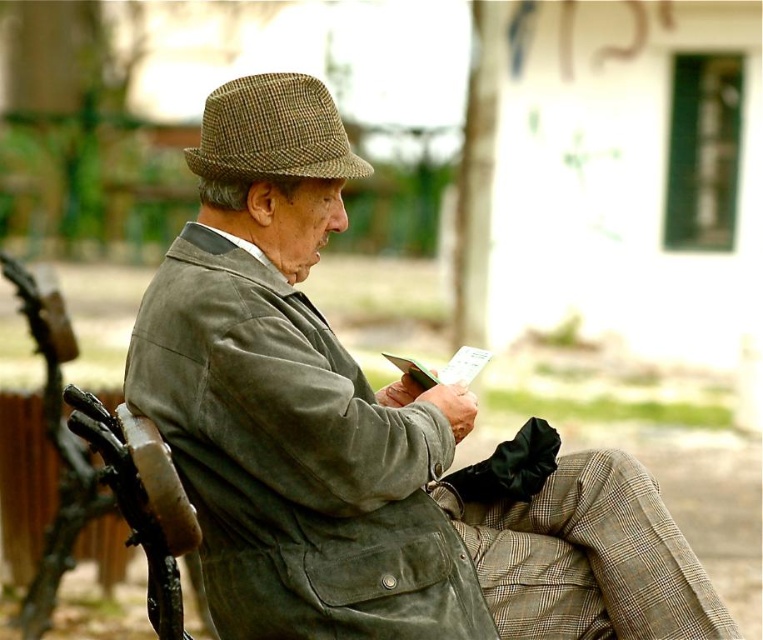
Based on the photo, you are a tailor who needs to determine which item requires more fabric to alter between the green corduroy trench coat at center and the brown checkered fedora at upper center. Based on their sizes, which one would need more fabric?

The green corduroy trench coat at center requires more fabric than the brown checkered fedora at upper center because it is larger in size.

Based on the photo, you are a fashion designer observing two coats at a fashion show. The first is a matte green coat at center, and the second is a green corduroy trench coat at center. Which coat has a larger size?

The matte green coat at center is bigger than the green corduroy trench coat at center, so the matte green coat at center has a larger size.

You are a tailor who needs to determine which item, the matte green coat at center or the brown checkered fedora at upper center, requires more vertical space for storage. Based on the scene, which one should you allocate more height for?

The matte green coat at center has a greater height compared to the brown checkered fedora at upper center, so you should allocate more vertical space for the matte green coat at center.